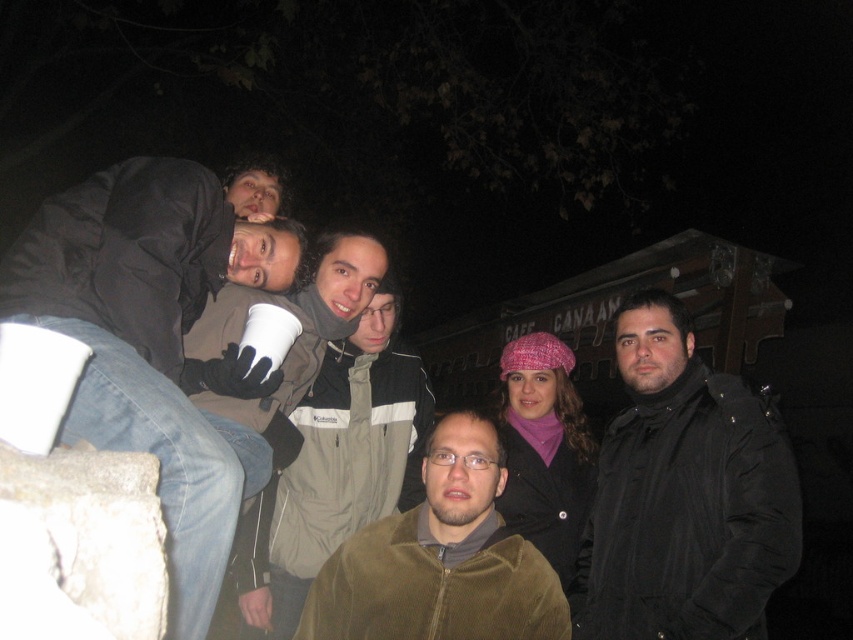
Can you confirm if corduroy jacket at center is taller than khaki corduroy jacket at center?

No.

Does corduroy jacket at center have a smaller size compared to khaki corduroy jacket at center?

Correct, corduroy jacket at center occupies less space than khaki corduroy jacket at center.

Locate an element on the screen. corduroy jacket at center is located at coordinates (440, 557).

Between white paper cup at upper left and khaki corduroy jacket at center, which one appears on the right side from the viewer's perspective?

From the viewer's perspective, khaki corduroy jacket at center appears more on the right side.

Who is higher up, white paper cup at upper left or khaki corduroy jacket at center?

Positioned higher is white paper cup at upper left.

The width and height of the screenshot is (853, 640). I want to click on white paper cup at upper left, so click(x=157, y=342).

Find the location of a particular element. Image resolution: width=853 pixels, height=640 pixels. white paper cup at upper left is located at coordinates (157, 342).

Who is more distant from viewer, (148,278) or (451,554)?

The point (451,554) is behind.

Does white paper cup at upper left lie behind corduroy jacket at center?

No.

Between point (213, 529) and point (527, 566), which one is positioned behind?

The point (527, 566) is more distant.

Image resolution: width=853 pixels, height=640 pixels. Identify the location of white paper cup at upper left. (157, 342).